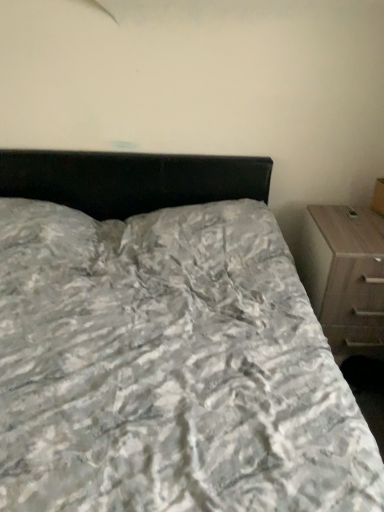
Question: In the image, is wooden chest of drawers at right on the left side or the right side of textured gray bedspread at center?

Choices:
 (A) left
 (B) right

Answer: (B)

Question: Is wooden chest of drawers at right situated inside textured gray bedspread at center or outside?

Choices:
 (A) inside
 (B) outside

Answer: (B)

Question: Is wooden chest of drawers at right wider or thinner than textured gray bedspread at center?

Choices:
 (A) thin
 (B) wide

Answer: (A)

Question: In the image, is textured gray bedspread at center on the left side or the right side of wooden chest of drawers at right?

Choices:
 (A) left
 (B) right

Answer: (A)

Question: In terms of width, does textured gray bedspread at center look wider or thinner when compared to wooden chest of drawers at right?

Choices:
 (A) wide
 (B) thin

Answer: (A)

Question: Is textured gray bedspread at center spatially inside wooden chest of drawers at right, or outside of it?

Choices:
 (A) inside
 (B) outside

Answer: (B)

Question: From a real-world perspective, relative to wooden chest of drawers at right, is textured gray bedspread at center vertically above or below?

Choices:
 (A) below
 (B) above

Answer: (B)